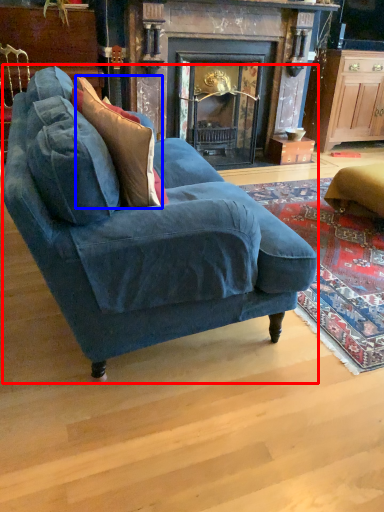
Question: Which point is further to the camera, studio couch (highlighted by a red box) or throw pillow (highlighted by a blue box)?

Choices:
 (A) studio couch
 (B) throw pillow

Answer: (B)